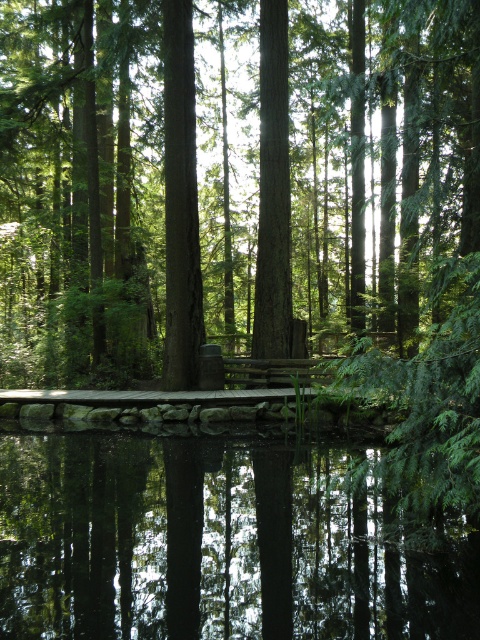
Is green matte tree at center to the right of transparent water at center from the viewer's perspective?

Incorrect, green matte tree at center is not on the right side of transparent water at center.

Does green matte tree at center appear under transparent water at center?

No, green matte tree at center is not below transparent water at center.

Between point (284, 102) and point (64, 522), which one is positioned in front?

Positioned in front is point (64, 522).

Where is `green matte tree at center`? green matte tree at center is located at coordinates (228, 182).